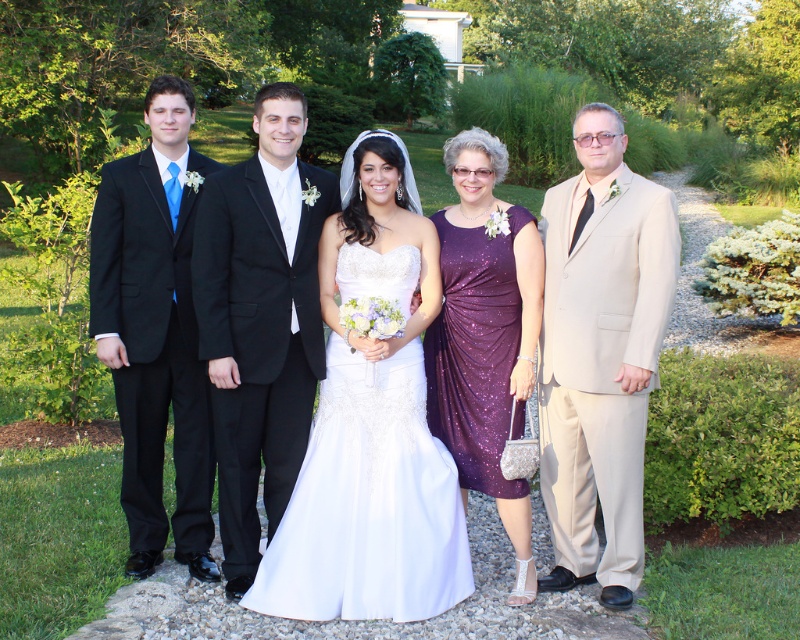
Question: Which of the following is the closest to the observer?

Choices:
 (A) beige satin suit at right
 (B) satin/embroidered dress at center
 (C) black satin suit at left

Answer: (A)

Question: Can you confirm if satin/embroidered dress at center is bigger than sparkly purple dress at center?

Choices:
 (A) yes
 (B) no

Answer: (A)

Question: Which point is closer to the camera?

Choices:
 (A) (480, 189)
 (B) (210, 353)

Answer: (B)

Question: Is beige satin suit at right positioned before satin/embroidered dress at center?

Choices:
 (A) no
 (B) yes

Answer: (B)

Question: Can you confirm if satin/embroidered dress at center is thinner than sparkly purple dress at center?

Choices:
 (A) no
 (B) yes

Answer: (A)

Question: Among these objects, which one is farthest from the camera?

Choices:
 (A) white satin dress at center
 (B) black satin suit at left

Answer: (B)